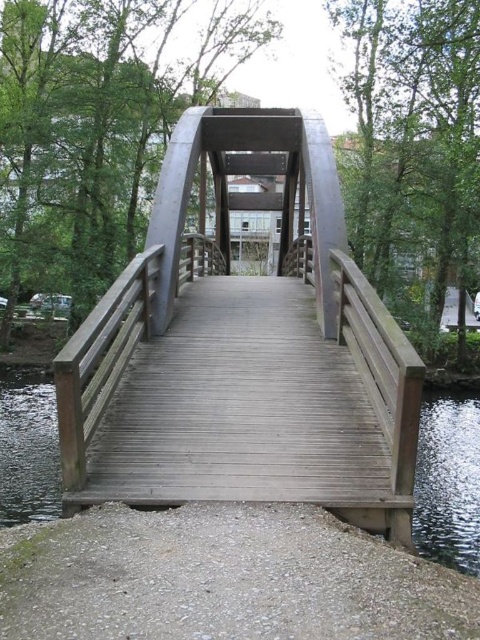
Question: Considering the relative positions of wooden bridge at center and smooth gravel path at lower center in the image provided, where is wooden bridge at center located with respect to smooth gravel path at lower center?

Choices:
 (A) above
 (B) below

Answer: (A)

Question: Is wooden bridge at center smaller than clear water at bridge center?

Choices:
 (A) no
 (B) yes

Answer: (A)

Question: Which of the following is the farthest from the observer?

Choices:
 (A) smooth gravel path at lower center
 (B) clear water at bridge center

Answer: (B)

Question: Which point is farther from the camera taking this photo?

Choices:
 (A) (36, 568)
 (B) (49, 449)
 (C) (229, 166)

Answer: (C)

Question: Among these points, which one is nearest to the camera?

Choices:
 (A) (196, 632)
 (B) (337, 211)

Answer: (A)

Question: Does wooden bridge at center have a larger size compared to clear water at bridge center?

Choices:
 (A) yes
 (B) no

Answer: (A)